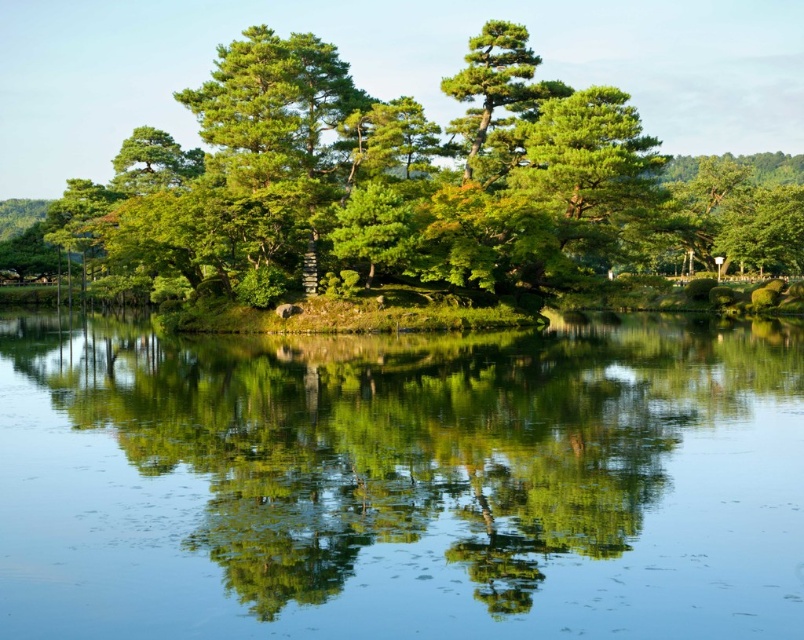
You are standing on the lakeside and want to know which object in the image takes up more area. Which one is it between the clear water at center and the green leafy tree at center?

The green leafy tree at center occupies more area than the clear water at center according to the description.

You are standing at the edge of the lake and see two points marked on the water surface. The first point is at coordinates point (241, 627), and the second is at point (794, 243). Which point is closer to your current position?

Point (241, 627) is closer to your current position because it is in front of point (794, 243), meaning it lies between you and the second point.